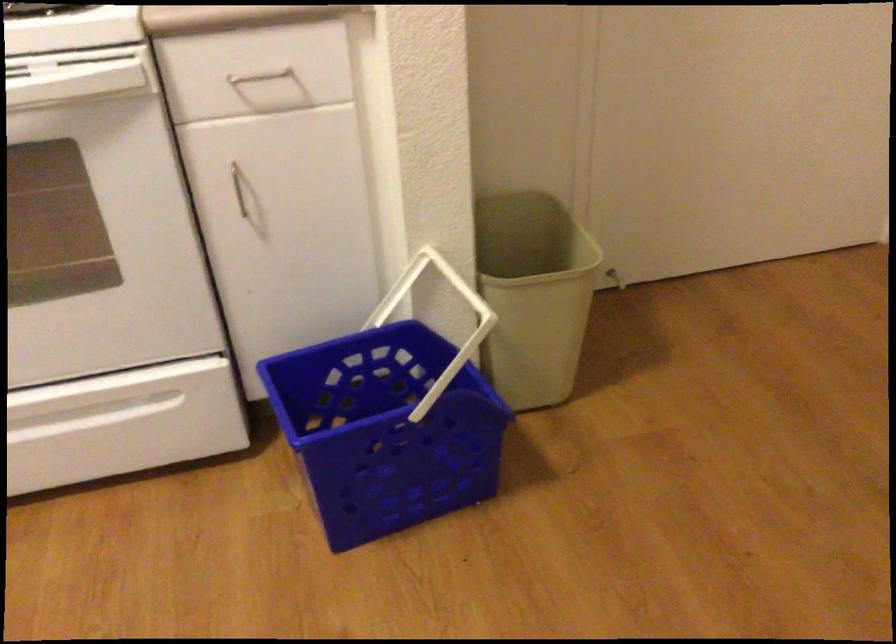
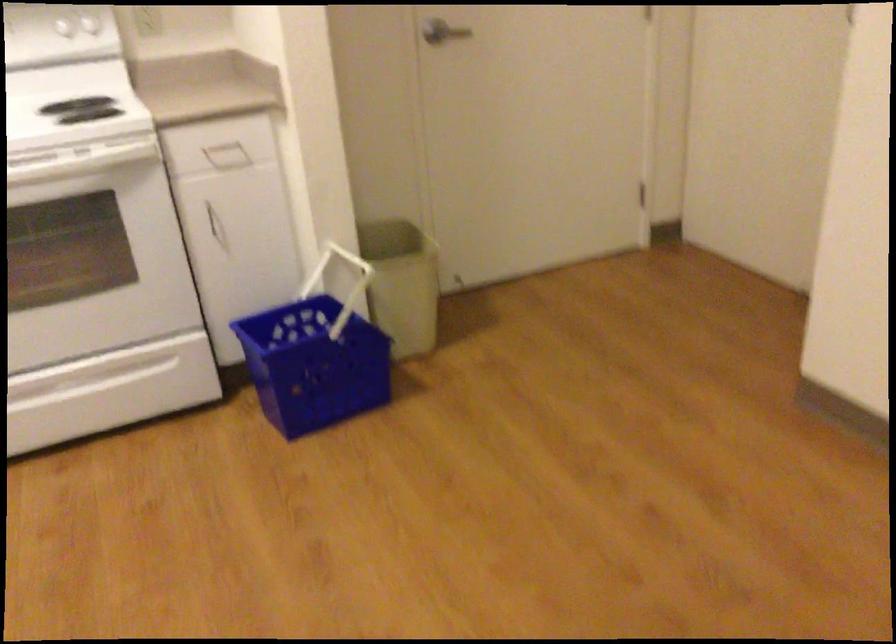
Question: I am providing you with two images of the same scene from different viewpoints. Please identify which objects are invisible in image2.

Choices:
 (A) oven door handle
 (B) beige trash can
 (C) silver door handle
 (D) none of these

Answer: (D)